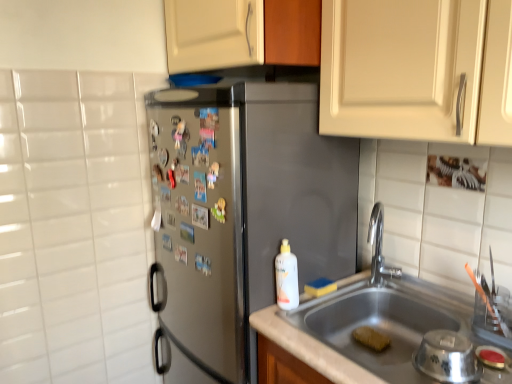
Locate an element on the screen. The width and height of the screenshot is (512, 384). vacant area that is situated to the right of polished chrome faucet at sink right is located at coordinates (429, 299).